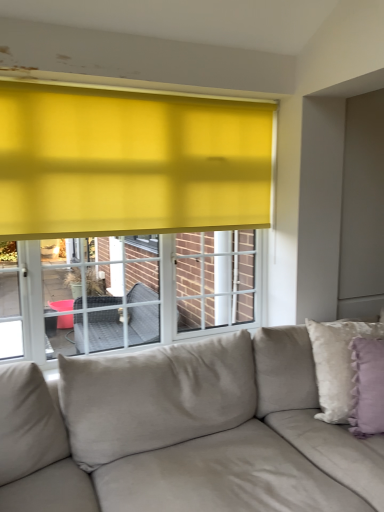
You are a GUI agent. You are given a task and a screenshot of the screen. Output one action in this format:
    pyautogui.click(x=<x>, y=<y>)
    Task: Click on the fluffy white pillow at right, which ranks as the 2th pillow in front-to-back order
    
    Given the screenshot: What is the action you would take?
    pyautogui.click(x=337, y=364)

In order to face suede-like beige couch at lower center, should I rotate leftwards or rightwards?

To align with it, rotate right about 13.069°.

This screenshot has height=512, width=384. In order to click on suede-like beige couch at lower center in this screenshot , I will do `click(184, 433)`.

Locate an element on the screen. fluffy white pillow at right, the 1th pillow positioned from the back is located at coordinates (337, 364).

From the image's perspective, who appears lower, lavender velvet pillow at right, which appears as the 1th pillow when viewed from the front, or fluffy white pillow at right, which ranks as the 2th pillow in front-to-back order?

lavender velvet pillow at right, which appears as the 1th pillow when viewed from the front, is shown below in the image.

Considering the sizes of objects lavender velvet pillow at right, which appears as the 1th pillow when viewed from the front, and fluffy white pillow at right, the 1th pillow positioned from the back, in the image provided, who is bigger, lavender velvet pillow at right, which appears as the 1th pillow when viewed from the front, or fluffy white pillow at right, the 1th pillow positioned from the back,?

fluffy white pillow at right, the 1th pillow positioned from the back.

Can you confirm if lavender velvet pillow at right, placed as the 2th pillow when sorted from back to front, is taller than fluffy white pillow at right, which ranks as the 2th pillow in front-to-back order?

No, lavender velvet pillow at right, placed as the 2th pillow when sorted from back to front, is not taller than fluffy white pillow at right, which ranks as the 2th pillow in front-to-back order.

Where is `studio couch in front of the lavender velvet pillow at right, which appears as the 1th pillow when viewed from the front`? studio couch in front of the lavender velvet pillow at right, which appears as the 1th pillow when viewed from the front is located at coordinates (184, 433).

Is lavender velvet pillow at right, placed as the 2th pillow when sorted from back to front, oriented towards suede-like beige couch at lower center?

Yes, lavender velvet pillow at right, placed as the 2th pillow when sorted from back to front, is aimed at suede-like beige couch at lower center.

From a real-world perspective, is lavender velvet pillow at right, placed as the 2th pillow when sorted from back to front, under suede-like beige couch at lower center?

Incorrect, from a real-world perspective, lavender velvet pillow at right, placed as the 2th pillow when sorted from back to front, is higher than suede-like beige couch at lower center.

What's the angular difference between lavender velvet pillow at right, which appears as the 1th pillow when viewed from the front, and suede-like beige couch at lower center's facing directions?

33.9 degrees.

Relative to lavender velvet pillow at right, placed as the 2th pillow when sorted from back to front, is suede-like beige couch at lower center in front or behind?

suede-like beige couch at lower center is positioned closer to the viewer than lavender velvet pillow at right, placed as the 2th pillow when sorted from back to front.

Is suede-like beige couch at lower center bigger or smaller than lavender velvet pillow at right, placed as the 2th pillow when sorted from back to front?

suede-like beige couch at lower center is bigger than lavender velvet pillow at right, placed as the 2th pillow when sorted from back to front.

Is suede-like beige couch at lower center directly adjacent to lavender velvet pillow at right, which appears as the 1th pillow when viewed from the front?

No, suede-like beige couch at lower center is not beside lavender velvet pillow at right, which appears as the 1th pillow when viewed from the front.

Is suede-like beige couch at lower center facing away from lavender velvet pillow at right, placed as the 2th pillow when sorted from back to front?

Correct, suede-like beige couch at lower center is looking away from lavender velvet pillow at right, placed as the 2th pillow when sorted from back to front.

Can you tell me how much suede-like beige couch at lower center and fluffy white pillow at right, which ranks as the 2th pillow in front-to-back order, differ in facing direction?

The facing directions of suede-like beige couch at lower center and fluffy white pillow at right, which ranks as the 2th pillow in front-to-back order, are 16.9 degrees apart.

Where is `studio couch directly beneath the fluffy white pillow at right, which ranks as the 2th pillow in front-to-back order (from a real-world perspective)`? Image resolution: width=384 pixels, height=512 pixels. studio couch directly beneath the fluffy white pillow at right, which ranks as the 2th pillow in front-to-back order (from a real-world perspective) is located at coordinates (184, 433).

Considering the relative positions of suede-like beige couch at lower center and fluffy white pillow at right, the 1th pillow positioned from the back, in the image provided, is suede-like beige couch at lower center to the right of fluffy white pillow at right, the 1th pillow positioned from the back, from the viewer's perspective?

No, suede-like beige couch at lower center is not to the right of fluffy white pillow at right, the 1th pillow positioned from the back.

Is suede-like beige couch at lower center facing towards fluffy white pillow at right, which ranks as the 2th pillow in front-to-back order?

Yes, suede-like beige couch at lower center is facing fluffy white pillow at right, which ranks as the 2th pillow in front-to-back order.

The width and height of the screenshot is (384, 512). I want to click on pillow below the fluffy white pillow at right, which ranks as the 2th pillow in front-to-back order (from the image's perspective), so click(367, 387).

Is fluffy white pillow at right, which ranks as the 2th pillow in front-to-back order, facing away from lavender velvet pillow at right, placed as the 2th pillow when sorted from back to front?

Yes, fluffy white pillow at right, which ranks as the 2th pillow in front-to-back order, is positioned with its back facing lavender velvet pillow at right, placed as the 2th pillow when sorted from back to front.

Is point (339, 381) closer or farther from the camera than point (372, 384)?

Point (339, 381) is farther from the camera than point (372, 384).

Who is bigger, fluffy white pillow at right, the 1th pillow positioned from the back, or lavender velvet pillow at right, placed as the 2th pillow when sorted from back to front?

With larger size is fluffy white pillow at right, the 1th pillow positioned from the back.

Considering the relative positions of fluffy white pillow at right, which ranks as the 2th pillow in front-to-back order, and suede-like beige couch at lower center in the image provided, is fluffy white pillow at right, which ranks as the 2th pillow in front-to-back order, to the right of suede-like beige couch at lower center from the viewer's perspective?

Correct, you'll find fluffy white pillow at right, which ranks as the 2th pillow in front-to-back order, to the right of suede-like beige couch at lower center.

Is fluffy white pillow at right, the 1th pillow positioned from the back, facing away from suede-like beige couch at lower center?

Yes, fluffy white pillow at right, the 1th pillow positioned from the back, is facing away from suede-like beige couch at lower center.

From the picture: Which object is closer to the camera, fluffy white pillow at right, which ranks as the 2th pillow in front-to-back order, or suede-like beige couch at lower center?

suede-like beige couch at lower center is closer to the camera.

Considering the relative sizes of fluffy white pillow at right, which ranks as the 2th pillow in front-to-back order, and suede-like beige couch at lower center in the image provided, is fluffy white pillow at right, which ranks as the 2th pillow in front-to-back order, thinner than suede-like beige couch at lower center?

Yes, fluffy white pillow at right, which ranks as the 2th pillow in front-to-back order, is thinner than suede-like beige couch at lower center.

At what (x,y) coordinates should I click in order to perform the action: click on pillow on the left of lavender velvet pillow at right, which appears as the 1th pillow when viewed from the front. Please return your answer as a coordinate pair (x, y). Image resolution: width=384 pixels, height=512 pixels. Looking at the image, I should click on (337, 364).

Find the location of a particular element. the 2nd pillow located above the suede-like beige couch at lower center (from a real-world perspective) is located at coordinates (367, 387).

Looking at the image, which one is located further to suede-like beige couch at lower center, fluffy white pillow at right, the 1th pillow positioned from the back, or lavender velvet pillow at right, which appears as the 1th pillow when viewed from the front?

lavender velvet pillow at right, which appears as the 1th pillow when viewed from the front, is positioned further to the anchor suede-like beige couch at lower center.

From the image, which object appears to be nearer to lavender velvet pillow at right, placed as the 2th pillow when sorted from back to front, fluffy white pillow at right, the 1th pillow positioned from the back, or suede-like beige couch at lower center?

fluffy white pillow at right, the 1th pillow positioned from the back, is positioned closer to the anchor lavender velvet pillow at right, placed as the 2th pillow when sorted from back to front.

From the image, which object appears to be nearer to suede-like beige couch at lower center, lavender velvet pillow at right, placed as the 2th pillow when sorted from back to front, or fluffy white pillow at right, which ranks as the 2th pillow in front-to-back order?

fluffy white pillow at right, which ranks as the 2th pillow in front-to-back order, is closer to suede-like beige couch at lower center.

When comparing their distances from lavender velvet pillow at right, which appears as the 1th pillow when viewed from the front, does suede-like beige couch at lower center or fluffy white pillow at right, which ranks as the 2th pillow in front-to-back order, seem further?

suede-like beige couch at lower center is further to lavender velvet pillow at right, which appears as the 1th pillow when viewed from the front.

From the image, which object appears to be nearer to fluffy white pillow at right, the 1th pillow positioned from the back, lavender velvet pillow at right, which appears as the 1th pillow when viewed from the front, or suede-like beige couch at lower center?

The object closer to fluffy white pillow at right, the 1th pillow positioned from the back, is lavender velvet pillow at right, which appears as the 1th pillow when viewed from the front.

When comparing their distances from fluffy white pillow at right, which ranks as the 2th pillow in front-to-back order, does suede-like beige couch at lower center or lavender velvet pillow at right, which appears as the 1th pillow when viewed from the front, seem further?

suede-like beige couch at lower center is further to fluffy white pillow at right, which ranks as the 2th pillow in front-to-back order.

Locate an element on the screen. The width and height of the screenshot is (384, 512). pillow between suede-like beige couch at lower center and fluffy white pillow at right, which ranks as the 2th pillow in front-to-back order, in the front-back direction is located at coordinates (367, 387).